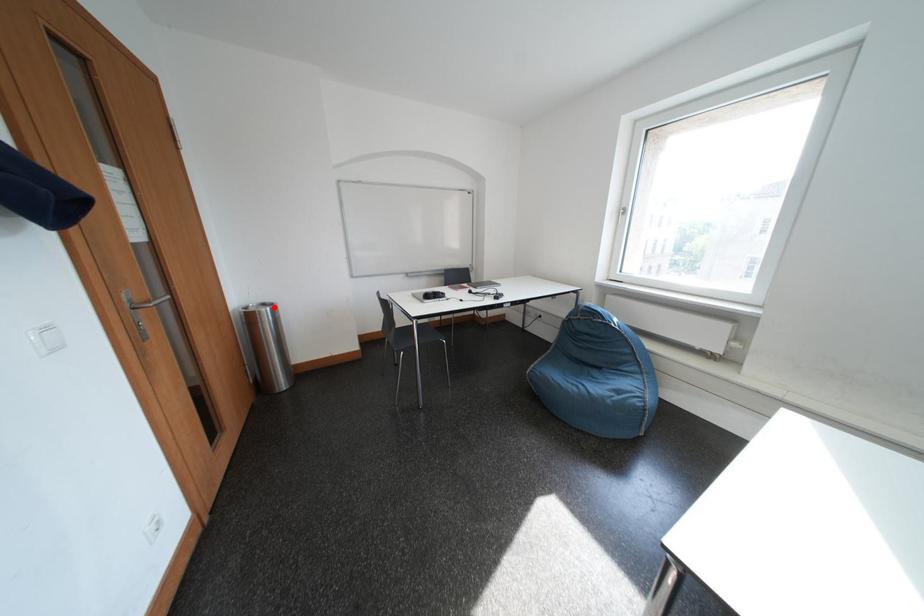
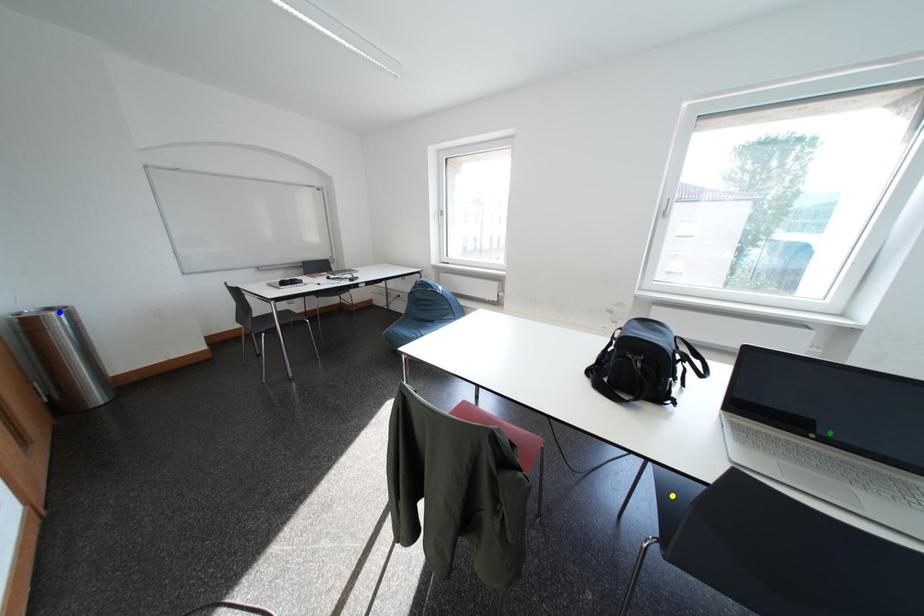
Question: I am providing you with two images of the same scene from different viewpoints. A red point is marked on the first image. You are given multiple points on the second image. Can you choose the point in image 2 that corresponds to the point in image 1?

Choices:
 (A) yellow point
 (B) green point
 (C) blue point

Answer: (C)